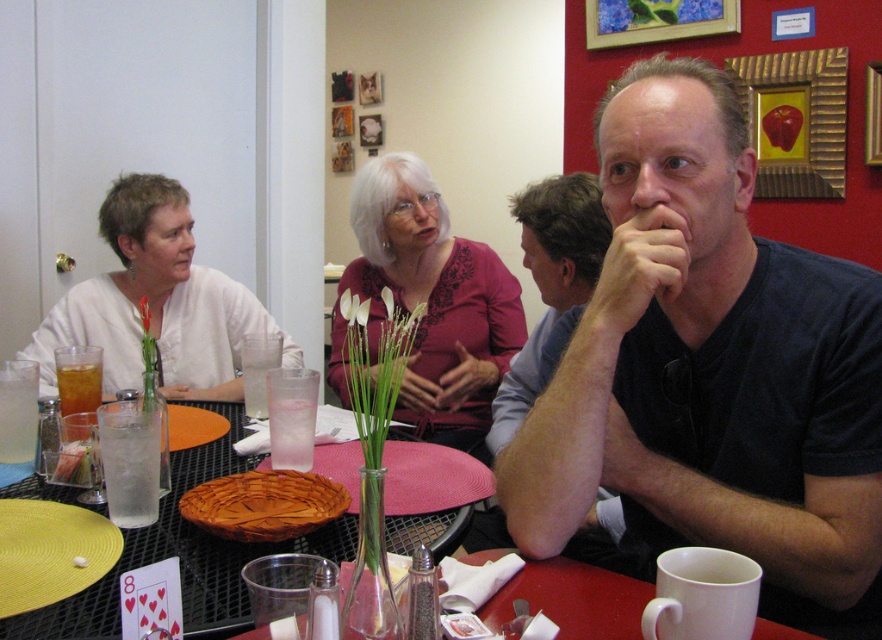
Looking at this image, you are a guest at the table and want to greet the person wearing the white matte shirt at left. Which direction should you turn your head to look at them from the position of the matte pink blouse at center?

Since the matte pink blouse at center is to the right of the white matte shirt at left, you should turn your head to the left to look at the white matte shirt at left from the position of the matte pink blouse at center.

You are sitting at the dining table and want to reach both the point at coordinates (262, 481) and the point at coordinates (69, 381). Which point will you reach first if you extend your hand straight out?

You will reach the point at coordinates (262, 481) first because it is closer to you than the point at coordinates (69, 381).